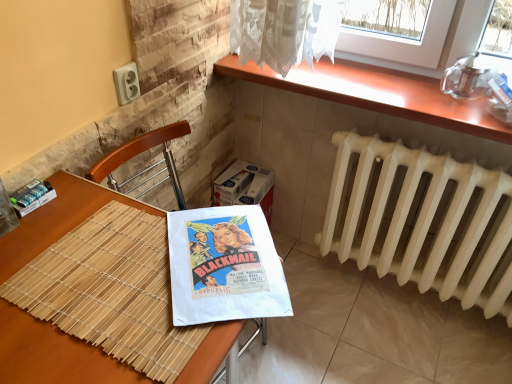
Image resolution: width=512 pixels, height=384 pixels. Find the location of `free space above wooden table at lower left (from a real-world perspective)`. free space above wooden table at lower left (from a real-world perspective) is located at coordinates (96, 279).